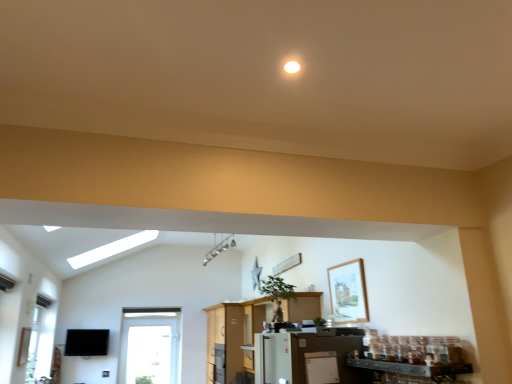
Question: Is transparent glass window at lower left next to white glossy refrigerator at center?

Choices:
 (A) no
 (B) yes

Answer: (A)

Question: Considering the relative positions of transparent glass window at lower left and white glossy refrigerator at center in the image provided, is transparent glass window at lower left in front of white glossy refrigerator at center?

Choices:
 (A) no
 (B) yes

Answer: (A)

Question: Is transparent glass window at lower left at the right side of white glossy refrigerator at center?

Choices:
 (A) yes
 (B) no

Answer: (B)

Question: Does transparent glass window at lower left come behind white glossy refrigerator at center?

Choices:
 (A) yes
 (B) no

Answer: (A)

Question: Is transparent glass window at lower left bigger than white glossy refrigerator at center?

Choices:
 (A) yes
 (B) no

Answer: (B)

Question: Would you say transparent glass window at lower left is a long distance from white glossy refrigerator at center?

Choices:
 (A) no
 (B) yes

Answer: (A)

Question: Is white glossy refrigerator at center at the left side of white matte refrigerator at lower center?

Choices:
 (A) yes
 (B) no

Answer: (A)

Question: Is white glossy refrigerator at center not near white matte refrigerator at lower center?

Choices:
 (A) no
 (B) yes

Answer: (B)

Question: Is white matte refrigerator at lower center surrounded by white glossy refrigerator at center?

Choices:
 (A) yes
 (B) no

Answer: (B)

Question: Is white glossy refrigerator at center beside white matte refrigerator at lower center?

Choices:
 (A) yes
 (B) no

Answer: (B)

Question: From a real-world perspective, is white glossy refrigerator at center physically below white matte refrigerator at lower center?

Choices:
 (A) yes
 (B) no

Answer: (B)

Question: Does white glossy refrigerator at center appear on the right side of white matte refrigerator at lower center?

Choices:
 (A) no
 (B) yes

Answer: (A)

Question: Is white matte refrigerator at lower center bigger than transparent glass window at lower left?

Choices:
 (A) yes
 (B) no

Answer: (B)